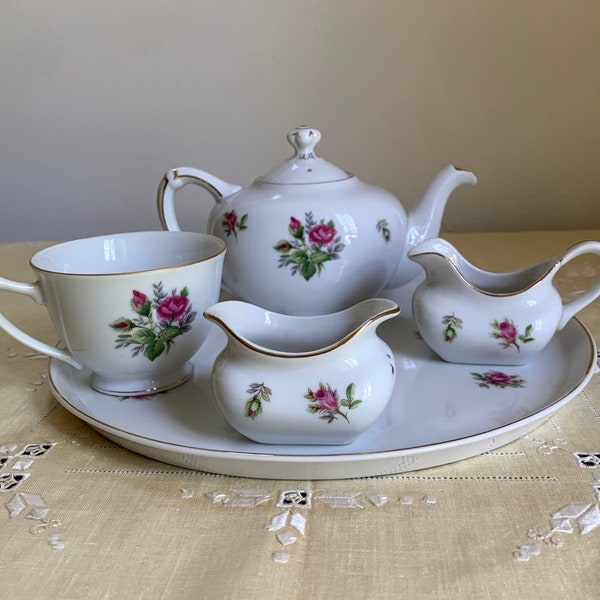
This screenshot has height=600, width=600. I want to click on pot, so click(289, 264).